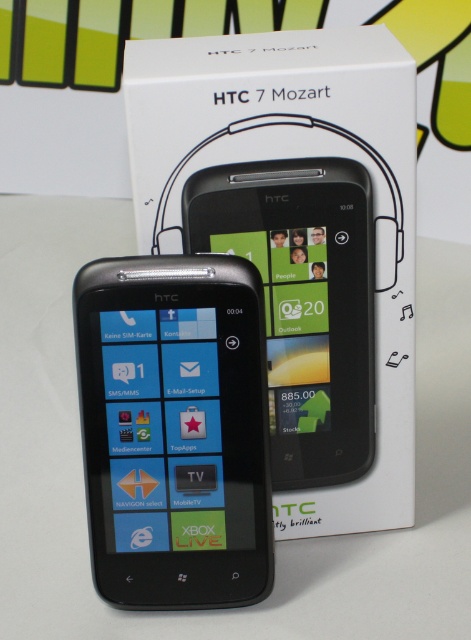
You are trying to determine which phone to place in a case that can only accommodate a width of 65mm. Given the two phones in the scene, the matte black phone at center and the black glossy smartphone at center, which one would fit better in the case?

The matte black phone at center has a smaller width than the black glossy smartphone at center, so it would fit better in the case designed for 65mm.

You are setting up a display for a tech store and need to arrange the white matte htc 7 mozart box at center and the black glossy smartphone at center. If you want to place the taller item on the shelf, which one should you choose?

The white matte htc 7 mozart box at center has a greater height compared to the black glossy smartphone at center, so you should choose the white matte htc 7 mozart box at center to place on the shelf as it is taller.

You are a delivery person who just arrived at a customer doorstep. You have a white matte htc 7 mozart box at center and a black htc 7 mozart phone in your hand. The customer wants to know if the phone will fit inside the box. Can you confirm?

The white matte htc 7 mozart box at center is positioned at point (299, 241), but this coordinate does not provide information about the box size. Without knowing the box dimensions, I cannot confirm if the phone will fit inside.